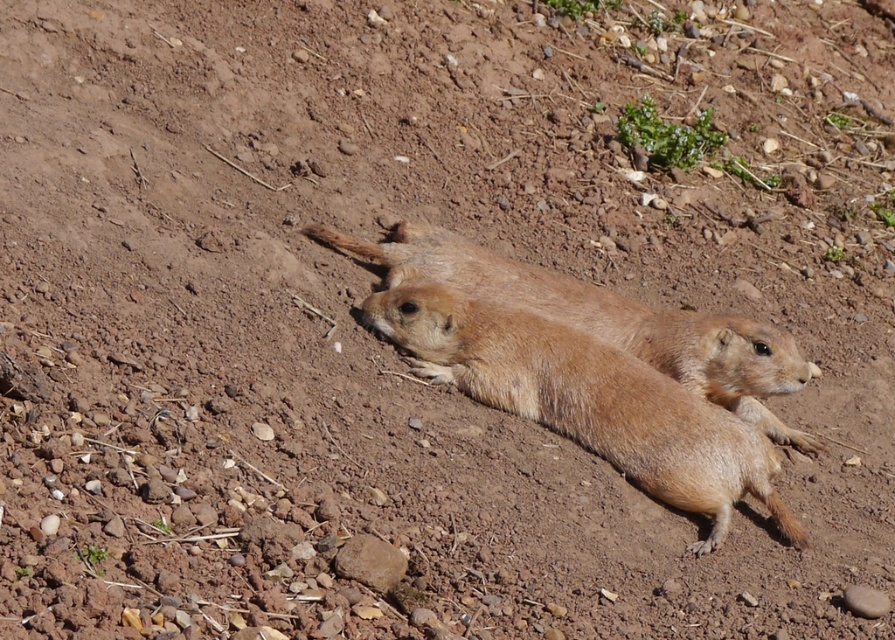
Question: Is the position of furry golden ground squirrel at center less distant than that of brown furry ground squirrel at center?

Choices:
 (A) yes
 (B) no

Answer: (A)

Question: Does furry golden ground squirrel at center appear under brown furry ground squirrel at center?

Choices:
 (A) yes
 (B) no

Answer: (A)

Question: Is furry golden ground squirrel at center smaller than brown furry ground squirrel at center?

Choices:
 (A) no
 (B) yes

Answer: (B)

Question: Among these objects, which one is nearest to the camera?

Choices:
 (A) furry golden ground squirrel at center
 (B) brown furry ground squirrel at center

Answer: (A)